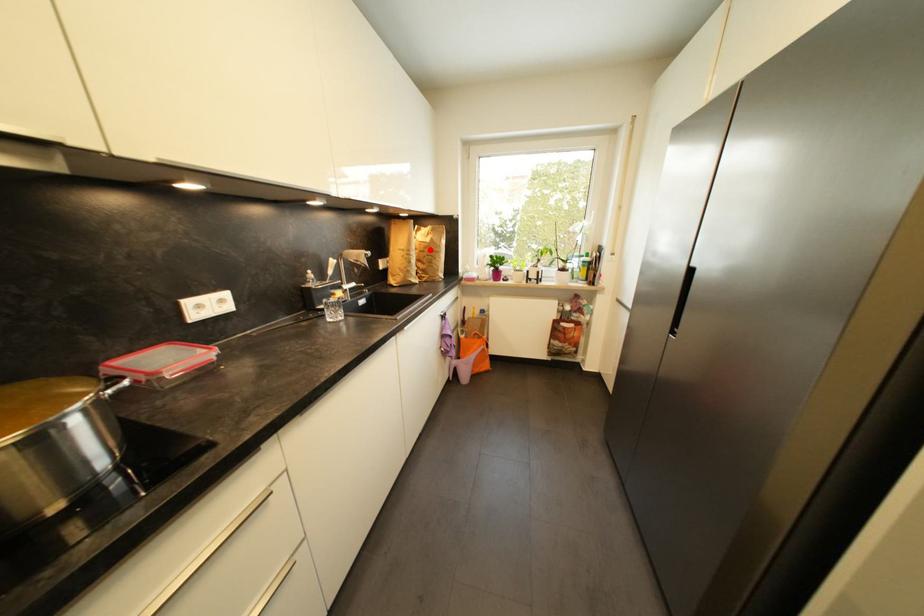
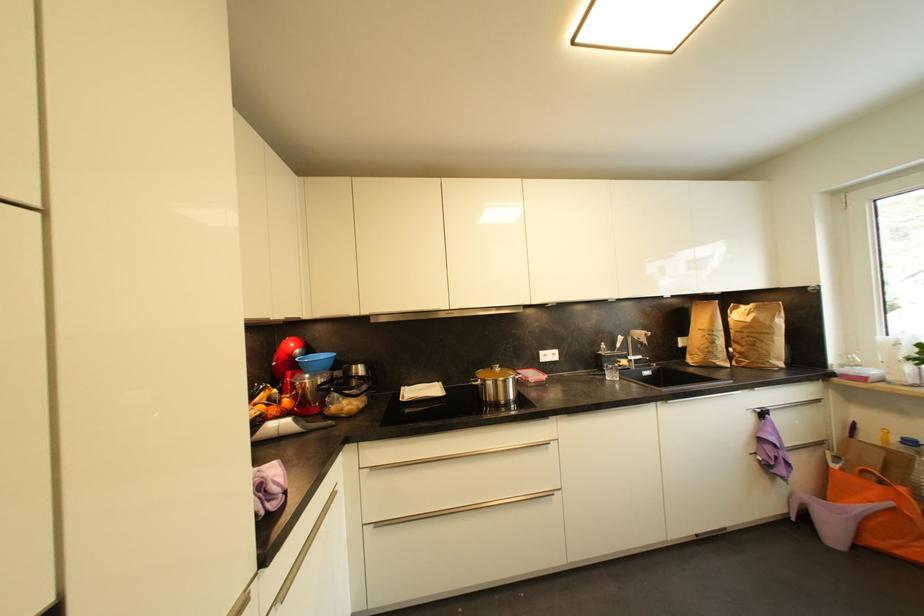
Locate, in the second image, the point that corresponds to the highlighted location in the first image.

(748, 330)